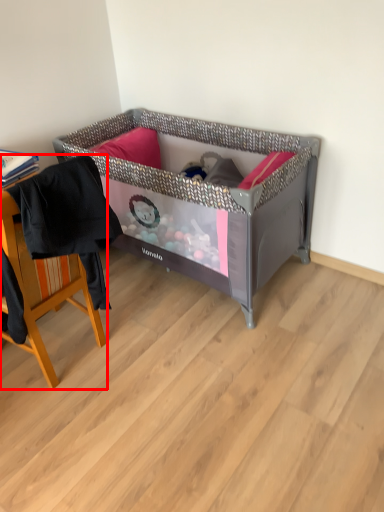
Question: Observing the image, what is the correct spatial positioning of chair (annotated by the red box) in reference to infant bed?

Choices:
 (A) left
 (B) right

Answer: (A)